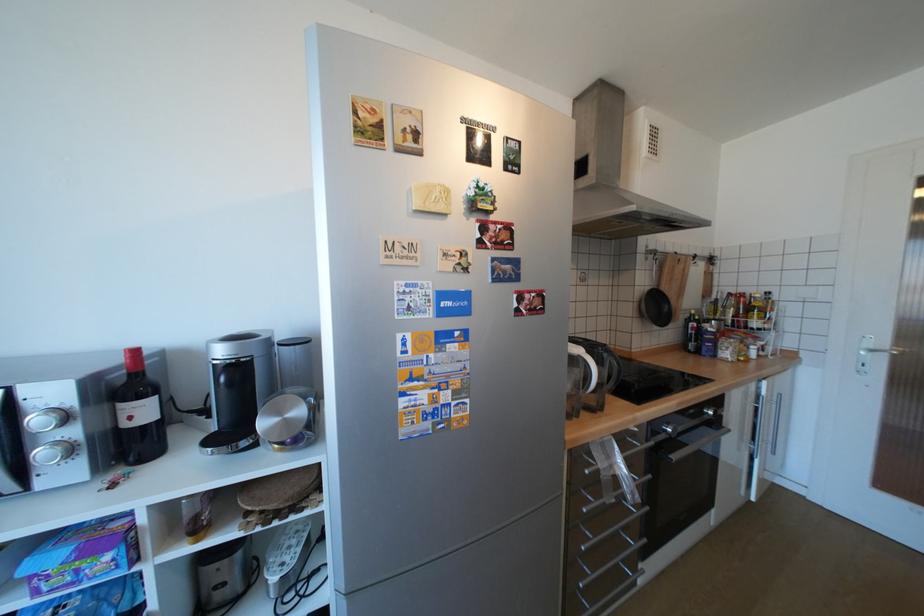
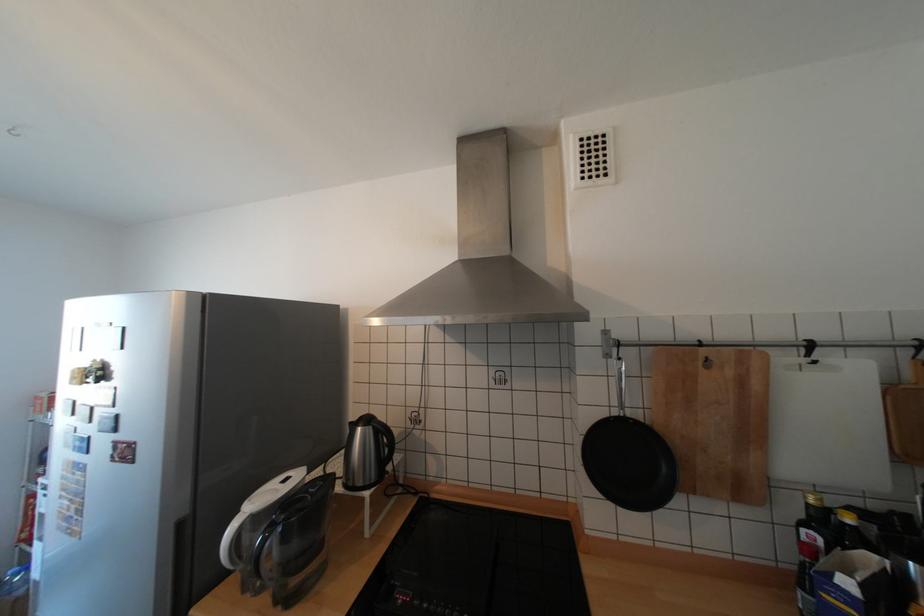
Find the pixel in the second image that matches (536,302) in the first image.

(128, 451)